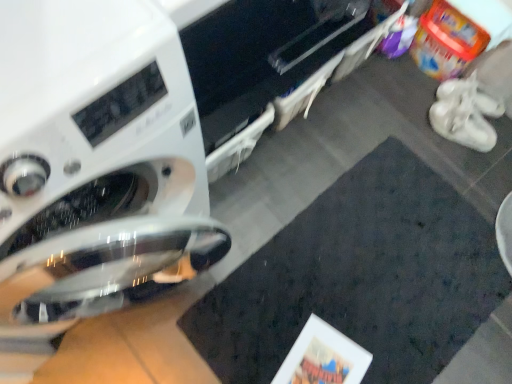
Where is `vacant space underneath dark matte mat at center (from a real-world perspective)`? The image size is (512, 384). vacant space underneath dark matte mat at center (from a real-world perspective) is located at coordinates (365, 286).